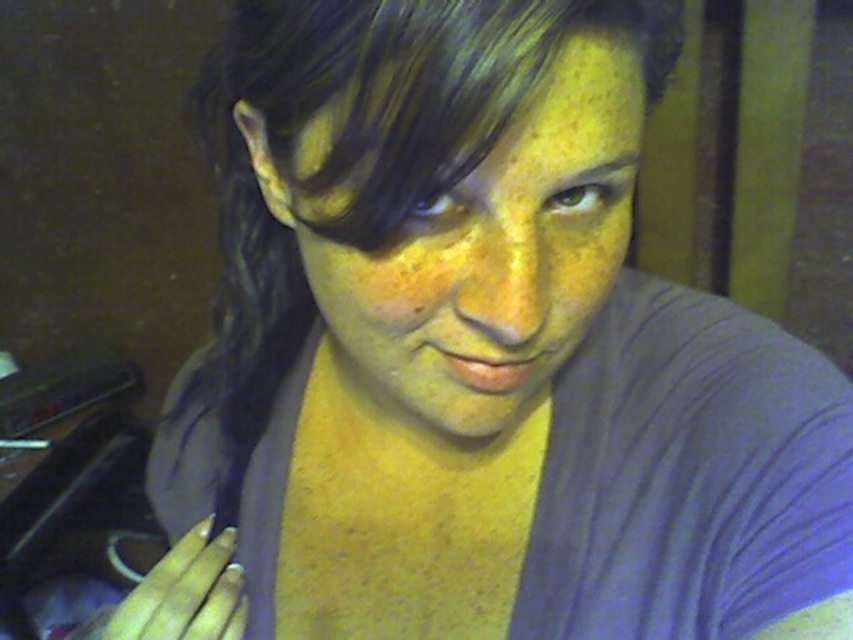
Which is in front, point (515, 269) or point (163, 557)?

Point (515, 269)

From the picture: Who is lower down, matte gray face at center or white painted nails at lower left?

white painted nails at lower left is lower down.

Which is behind, point (466, 401) or point (207, 612)?

Point (207, 612)

At what (x,y) coordinates should I click in order to perform the action: click on matte gray face at center. Please return your answer as a coordinate pair (x, y). Image resolution: width=853 pixels, height=640 pixels. Looking at the image, I should click on (494, 257).